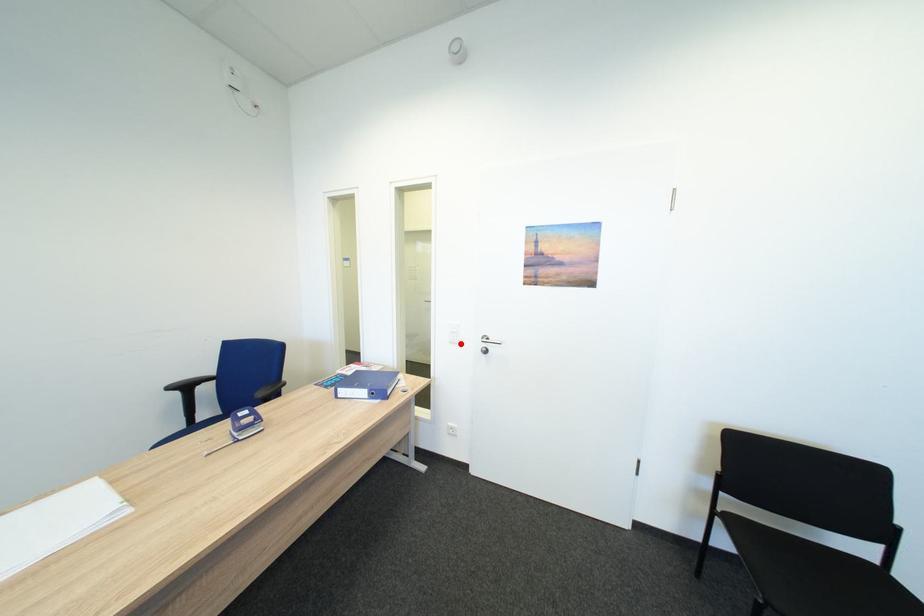
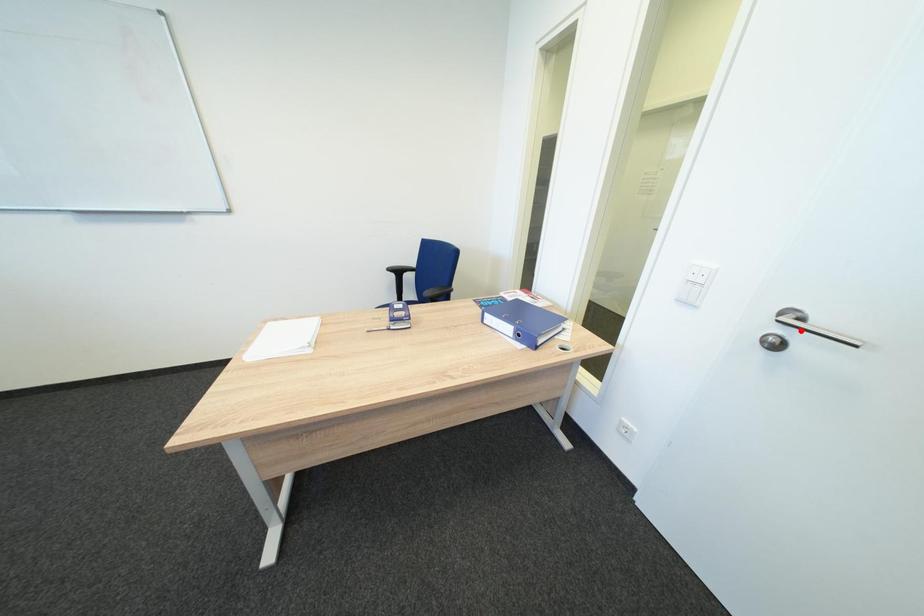
I am providing you with two images of the same scene from different viewpoints. A red point is marked on the first image and another point is marked on the second image. Is the red point in image1 aligned with the point shown in image2?

No